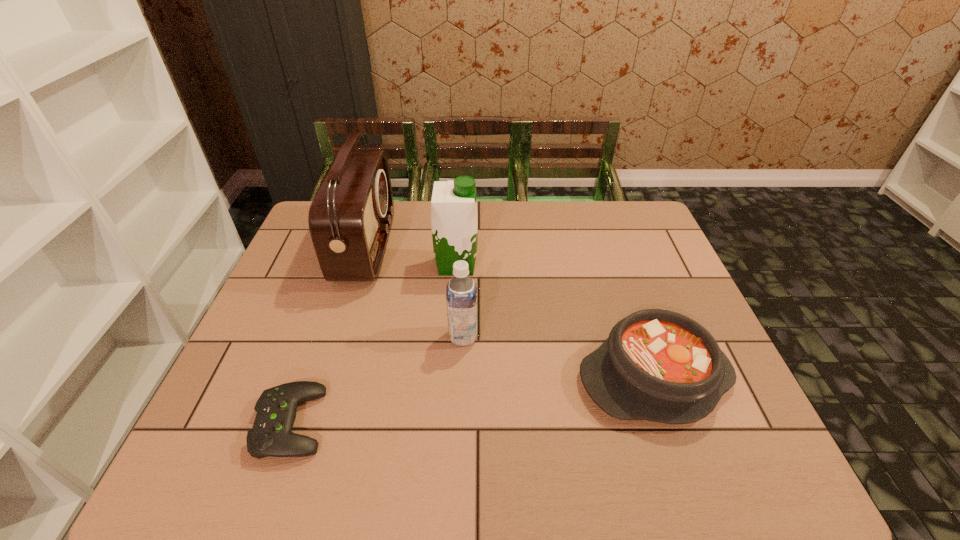
This screenshot has height=540, width=960. Identify the location of radio receiver. point(350,218).

Where is `the taller soya milk`? Image resolution: width=960 pixels, height=540 pixels. the taller soya milk is located at coordinates (454, 220).

Where is `the second tallest object`? the second tallest object is located at coordinates (454, 220).

The width and height of the screenshot is (960, 540). What are the coordinates of `the shorter soya milk` in the screenshot? It's located at pyautogui.click(x=461, y=293).

The image size is (960, 540). Find the location of `the third shortest object`. the third shortest object is located at coordinates point(461,293).

The width and height of the screenshot is (960, 540). I want to click on the fourth tallest object, so click(658, 365).

The width and height of the screenshot is (960, 540). What are the coordinates of `the rightmost object` in the screenshot? It's located at (658, 365).

This screenshot has width=960, height=540. Identify the location of the shortest object. (271, 435).

The width and height of the screenshot is (960, 540). Identify the location of free space located on the front panel of the radio receiver. (410, 248).

Where is `free spot located on the front-facing side of the second tallest object`? The width and height of the screenshot is (960, 540). free spot located on the front-facing side of the second tallest object is located at coordinates point(562,265).